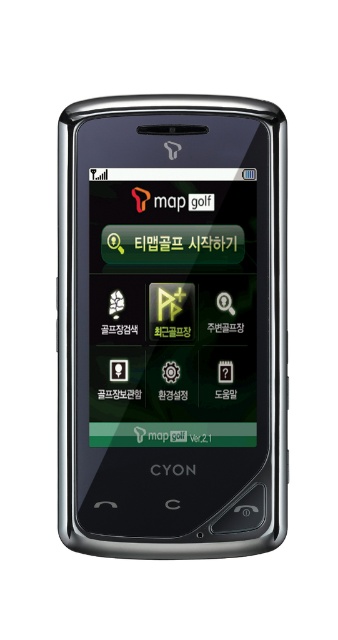
You are holding a smartphone with a map golf app open. There is a point at coordinates [172,326] on the screen. Based on the description, where is this point located?

The point is located on the satin black smartphone at center.